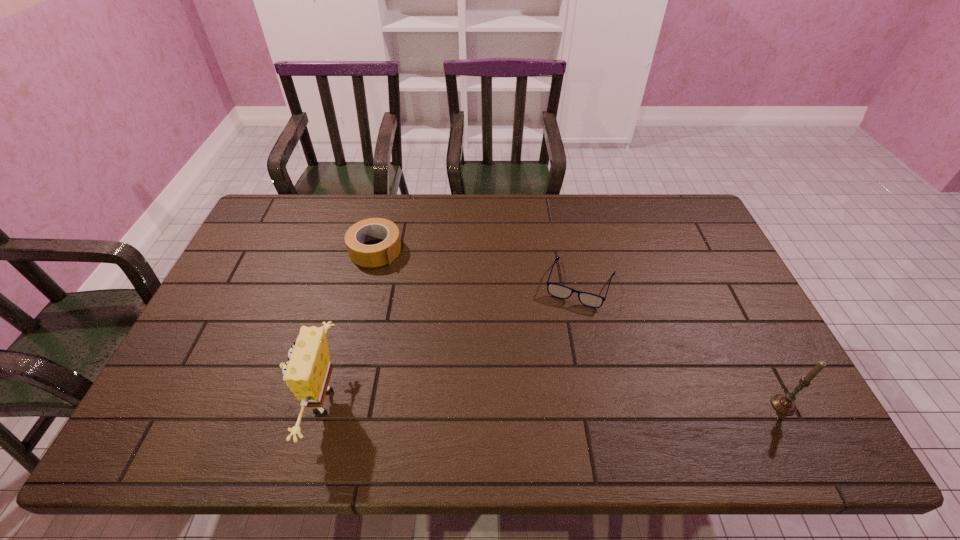
Find the location of a particular element. free space on the desktop that is between the tallest object and the candle and is positioned on the front-facing side of the third object from left to right is located at coordinates (542, 404).

Locate an element on the screen. The image size is (960, 540). free space on the desktop that is between the tallest object and the second tallest object and is positioned at the edge of the duct tape is located at coordinates (543, 404).